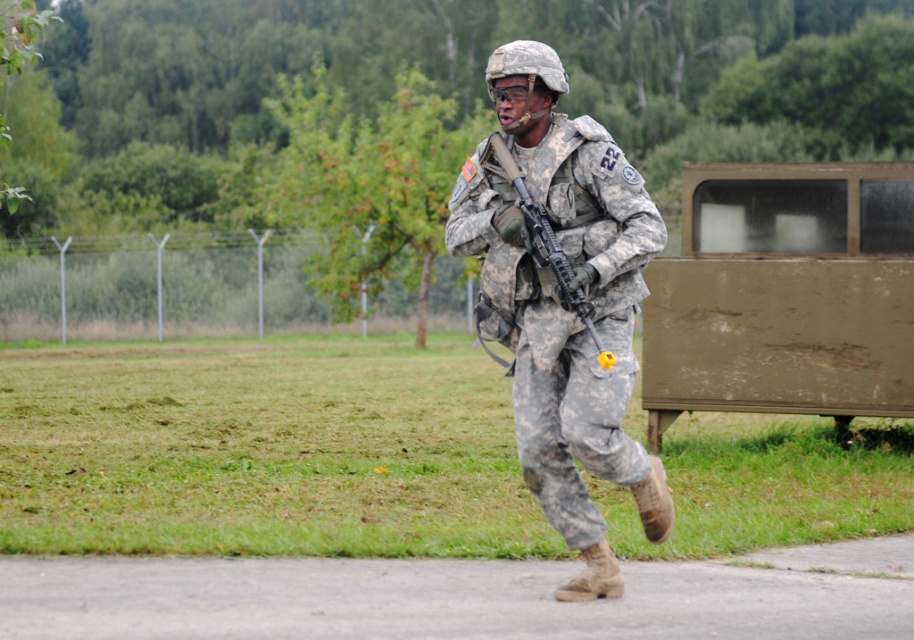
You are a military observer assessing the equipment of a soldier in a training exercise. You notice the camouflage uniform at center and the matte black rifle at center. Which piece of equipment is larger in size?

The camouflage uniform at center is bigger than the matte black rifle at center.

You are a drone operator trying to capture a clear image of the camouflage uniform at center. The drone is currently positioned 5 meters away from the target. Should you move the drone closer or farther away to ensure the camera can focus properly?

The camouflage uniform at center is 6.46 meters away from the camera. Since the drone is currently 5 meters away, it is closer than the required distance. To ensure proper focus, you should move the drone farther away to match the 6.46 meters distance specified.

You are a photographer trying to capture the soldier in the image. Since you want to focus on the soldier, you need to adjust your camera settings so that the camouflage uniform at center and the matte black rifle at center are both in frame. Given their sizes, which object should you ensure is fully visible first?

The camouflage uniform at center has a greater height compared to the matte black rifle at center, so you should ensure the camouflage uniform at center is fully visible first to accommodate its larger size in the frame.